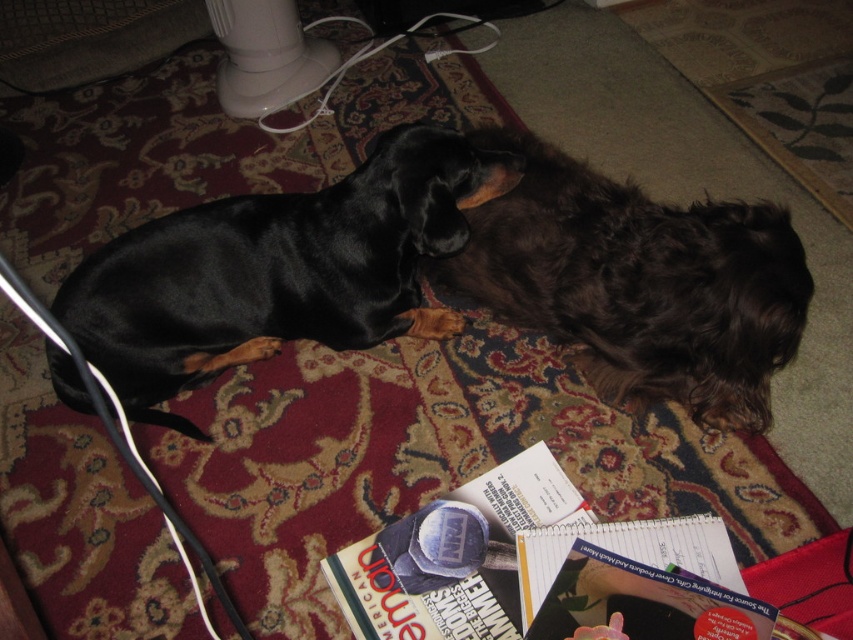
Based on the coordinates provided, which object is located at point (x=277, y=269)?

The point (x=277, y=269) indicates the location of the black shiny dog at left.

Consider the image. You are standing in the room and want to pick up the items in front of the dogs. If you start at the point closest to you, which point should you go to first, point (x=302, y=269) or point (x=740, y=365)?

Point (x=740, y=365) is closer to you, so you should go to point (x=740, y=365) first.

You are a dog trainer who needs to place a treat between the black shiny dog at left and the shaggy brown dog at center. Can you fit a treat that is 10 inches long in the space between them?

The distance between the black shiny dog at left and the shaggy brown dog at center is 12.39 inches, so yes, a 10 inch treat can fit between them since it is shorter than the available space.